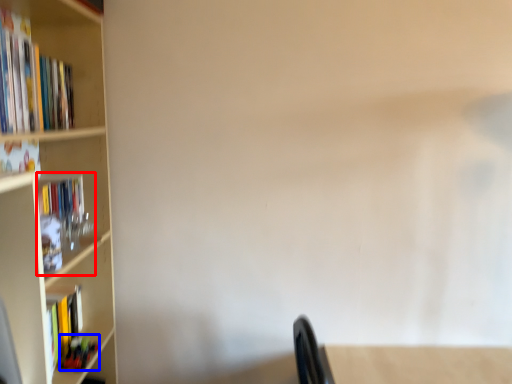
Question: Which of the following is the farthest to the observer, book (highlighted by a red box) or book (highlighted by a blue box)?

Choices:
 (A) book
 (B) book

Answer: (B)